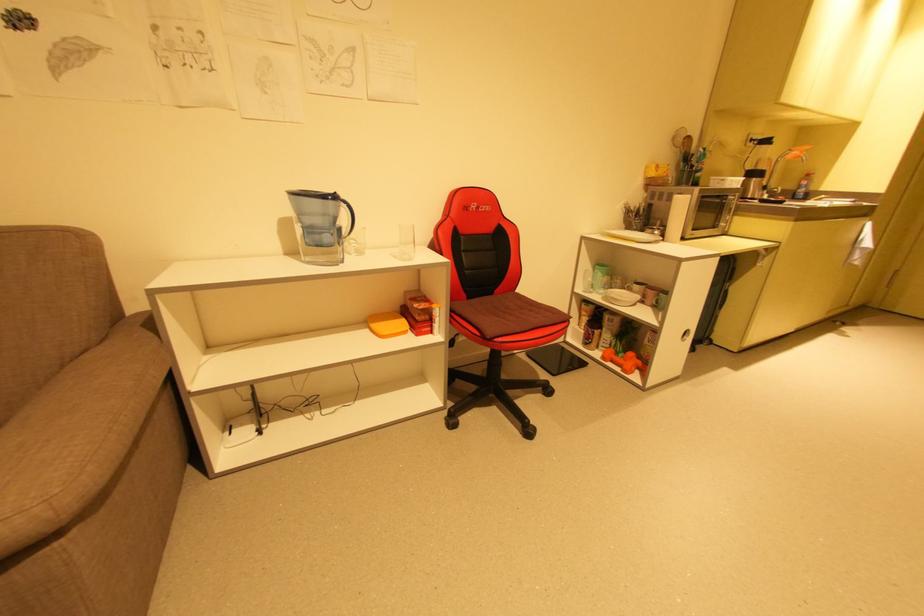
This screenshot has width=924, height=616. I want to click on water pitcher handle, so click(345, 208).